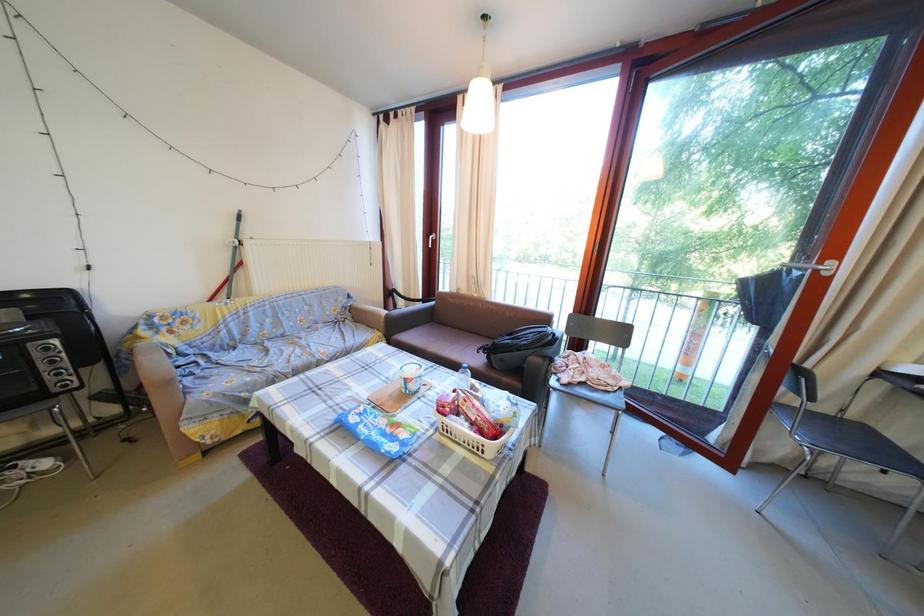
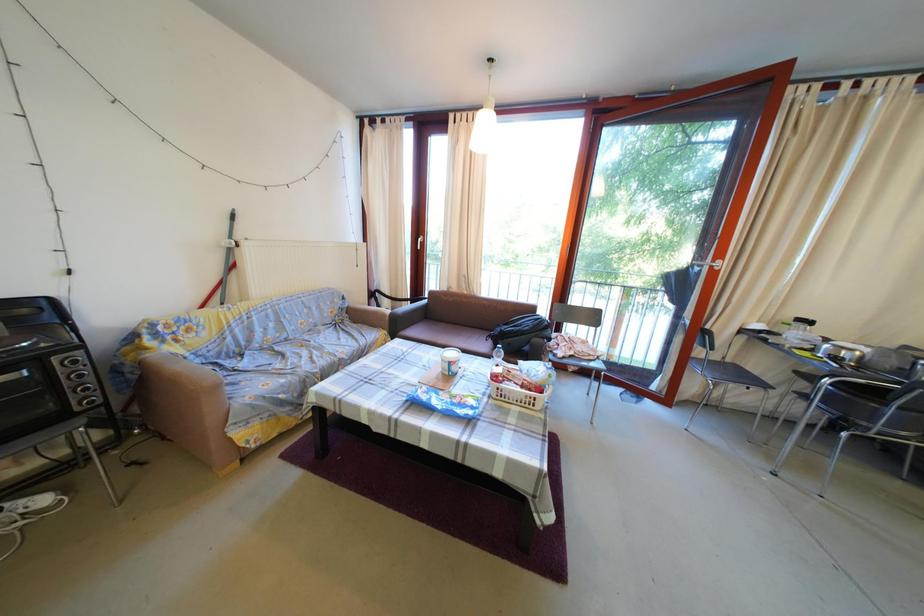
Which direction would the cameraman need to move to produce the second image?

The cameraman walked toward left, backward.